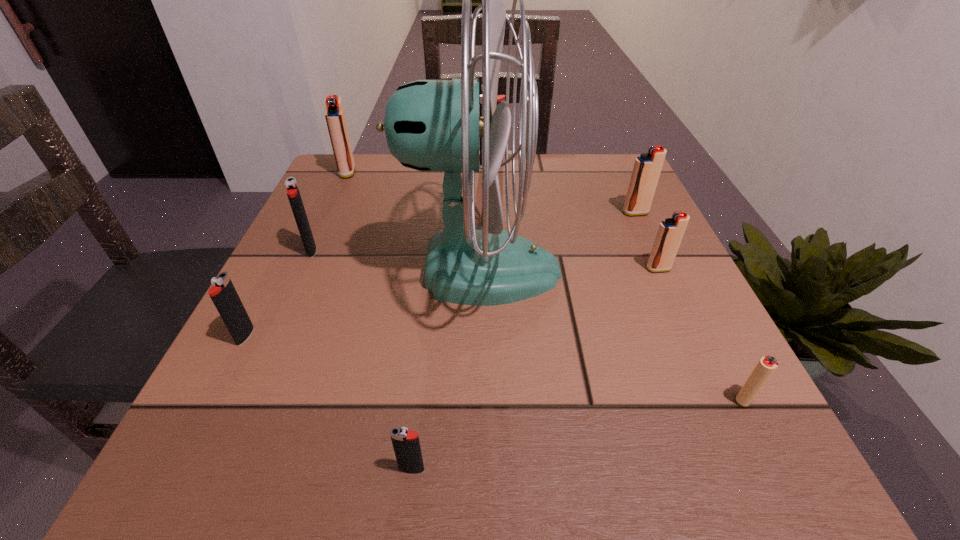
The width and height of the screenshot is (960, 540). What are the coordinates of `black igniter that can be found as the closest to the second black igniter from left to right` in the screenshot? It's located at (224, 295).

What are the coordinates of `free space that satisfies the following two spatial constraints: 1. on the front side of the leftmost black igniter; 2. on the left side of the second nearest object` in the screenshot? It's located at (213, 399).

At what (x,y) coordinates should I click in order to perform the action: click on vacant space that satisfies the following two spatial constraints: 1. on the front side of the smallest red igniter; 2. on the right side of the third nearest igniter. Please return your answer as a coordinate pair (x, y). Image resolution: width=960 pixels, height=540 pixels. Looking at the image, I should click on (213, 399).

In order to click on free space that satisfies the following two spatial constraints: 1. on the front side of the fifth igniter from right to left; 2. on the right side of the fourth farthest igniter in this screenshot , I will do `click(211, 469)`.

The height and width of the screenshot is (540, 960). What are the coordinates of `vacant space that satisfies the following two spatial constraints: 1. on the back side of the nearest object; 2. on the right side of the rightmost black igniter` in the screenshot? It's located at (447, 164).

Where is `vacant region that satisfies the following two spatial constraints: 1. on the back side of the nearest igniter; 2. on the right side of the fifth igniter from left to right`? Image resolution: width=960 pixels, height=540 pixels. vacant region that satisfies the following two spatial constraints: 1. on the back side of the nearest igniter; 2. on the right side of the fifth igniter from left to right is located at coordinates (447, 164).

Where is `vacant region that satisfies the following two spatial constraints: 1. in front of the fan, directing airflow; 2. on the front side of the nearest object`? Image resolution: width=960 pixels, height=540 pixels. vacant region that satisfies the following two spatial constraints: 1. in front of the fan, directing airflow; 2. on the front side of the nearest object is located at coordinates [479, 469].